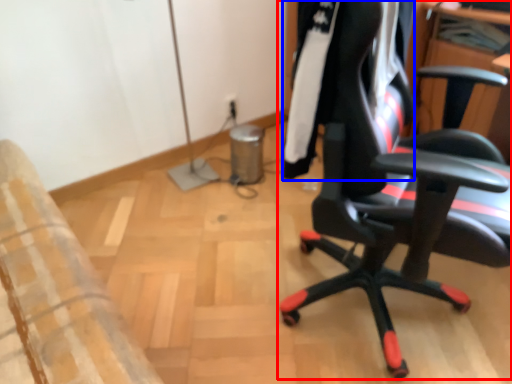
Question: Among these objects, which one is nearest to the camera, chair (highlighted by a red box) or clothing (highlighted by a blue box)?

Choices:
 (A) chair
 (B) clothing

Answer: (A)